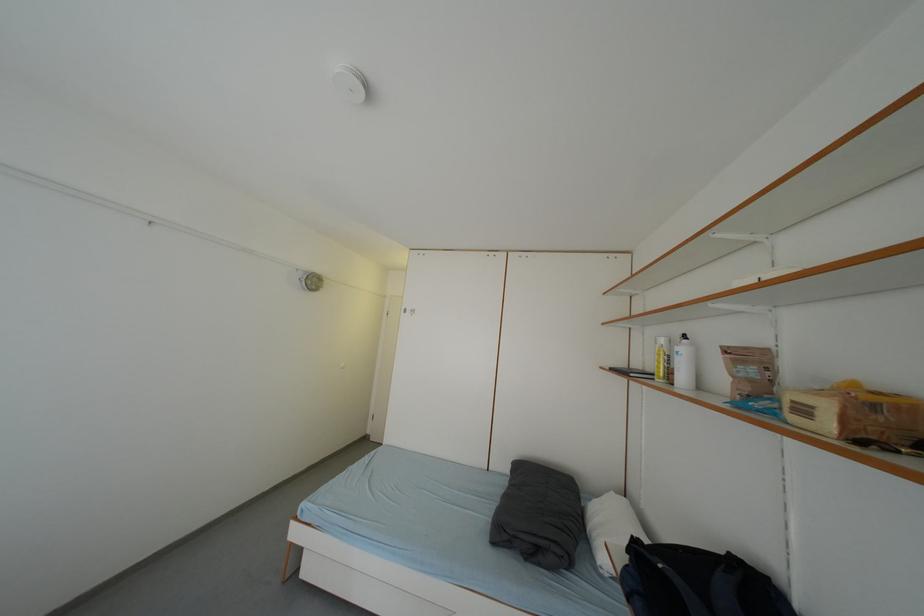
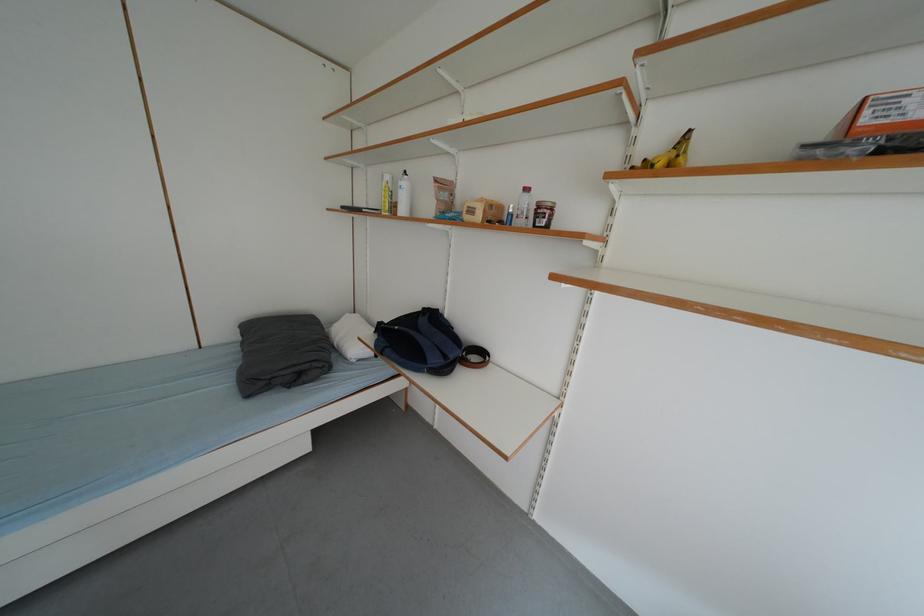
Where in the second image is the point corresponding to pixel 836 429 from the first image?

(487, 220)